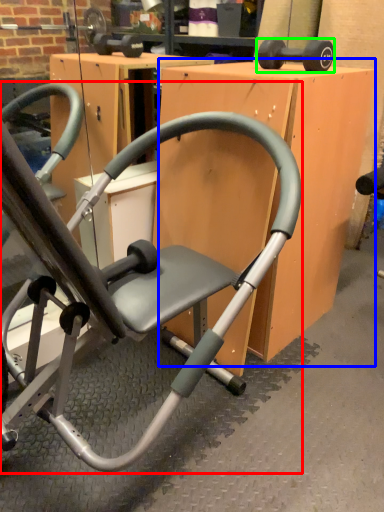
Question: Considering the real-world distances, which object is farthest from chair (highlighted by a red box)? table (highlighted by a blue box) or dumbbell (highlighted by a green box)?

Choices:
 (A) table
 (B) dumbbell

Answer: (B)